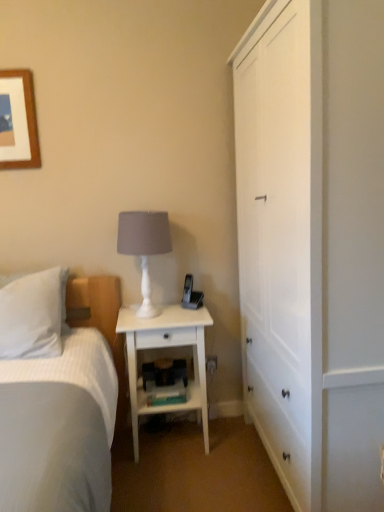
Question: Should I look upward or downward to see white plastic electric outlet at lower center?

Choices:
 (A) down
 (B) up

Answer: (A)

Question: Should I look upward or downward to see white matte table lamp at center?

Choices:
 (A) up
 (B) down

Answer: (B)

Question: Can white soft pillow at left be found inside white matte table lamp at center?

Choices:
 (A) no
 (B) yes

Answer: (A)

Question: Is white matte table lamp at center located outside white soft pillow at left?

Choices:
 (A) yes
 (B) no

Answer: (A)

Question: Considering the relative sizes of white matte table lamp at center and white soft pillow at left in the image provided, is white matte table lamp at center smaller than white soft pillow at left?

Choices:
 (A) yes
 (B) no

Answer: (A)

Question: Are white matte table lamp at center and white soft pillow at left far apart?

Choices:
 (A) no
 (B) yes

Answer: (A)

Question: Can you confirm if white matte table lamp at center is shorter than white soft pillow at left?

Choices:
 (A) no
 (B) yes

Answer: (A)

Question: Can you confirm if white matte table lamp at center is taller than white soft pillow at left?

Choices:
 (A) no
 (B) yes

Answer: (B)

Question: Is white matte table lamp at center looking in the opposite direction of white wood cabinet at right?

Choices:
 (A) no
 (B) yes

Answer: (A)

Question: Is white wood cabinet at right located within white matte table lamp at center?

Choices:
 (A) no
 (B) yes

Answer: (A)

Question: Considering the relative sizes of white matte table lamp at center and white wood cabinet at right in the image provided, is white matte table lamp at center taller than white wood cabinet at right?

Choices:
 (A) yes
 (B) no

Answer: (B)

Question: From the image's perspective, is white matte table lamp at center on top of white wood cabinet at right?

Choices:
 (A) no
 (B) yes

Answer: (A)

Question: Would you say white matte table lamp at center is a long distance from white wood cabinet at right?

Choices:
 (A) no
 (B) yes

Answer: (A)

Question: Could you tell me if white matte table lamp at center is facing white wood cabinet at right?

Choices:
 (A) yes
 (B) no

Answer: (B)

Question: Is white plastic electric outlet at lower center to the right of white wood nightstand at center from the viewer's perspective?

Choices:
 (A) yes
 (B) no

Answer: (A)